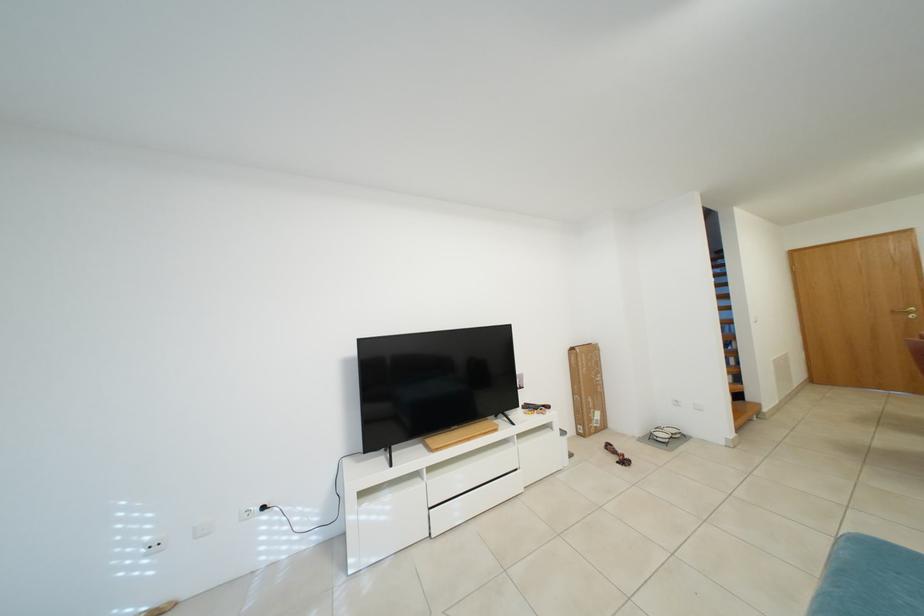
Identify the location of brown cardboard box. This screenshot has width=924, height=616. (587, 389).